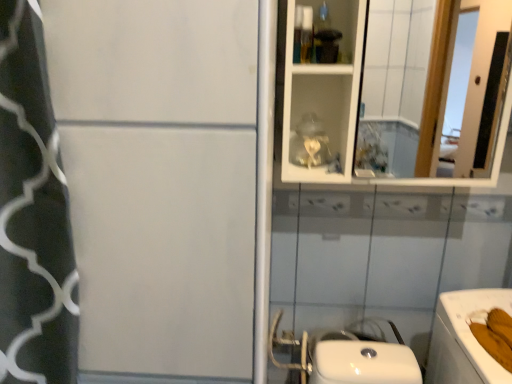
Image resolution: width=512 pixels, height=384 pixels. What do you see at coordinates (430, 87) in the screenshot? I see `white glossy mirror at upper right` at bounding box center [430, 87].

Where is `white glossy mirror at upper right`? white glossy mirror at upper right is located at coordinates (430, 87).

The height and width of the screenshot is (384, 512). In order to click on white glossy bath at lower right in this screenshot , I will do `click(465, 338)`.

This screenshot has width=512, height=384. Describe the element at coordinates (465, 338) in the screenshot. I see `white glossy bath at lower right` at that location.

Locate an element on the screen. This screenshot has height=384, width=512. white glossy mirror at upper right is located at coordinates (430, 87).

Considering the positions of objects white glossy bath at lower right and white glossy mirror at upper right in the image provided, who is more to the left, white glossy bath at lower right or white glossy mirror at upper right?

Positioned to the left is white glossy mirror at upper right.

Which object is further away from the camera taking this photo, white glossy bath at lower right or white glossy mirror at upper right?

Positioned behind is white glossy mirror at upper right.

Is point (445, 301) less distant than point (418, 119)?

Yes, point (445, 301) is in front of point (418, 119).

From the image's perspective, between white glossy bath at lower right and white glossy mirror at upper right, who is located below?

white glossy bath at lower right is shown below in the image.

Looking at this image, from a real-world perspective, does white glossy bath at lower right sit lower than white glossy mirror at upper right?

Yes, from a real-world perspective, white glossy bath at lower right is below white glossy mirror at upper right.

Which object is thinner, white glossy bath at lower right or white glossy mirror at upper right?

Thinner between the two is white glossy mirror at upper right.

Is white glossy bath at lower right taller or shorter than white glossy mirror at upper right?

Clearly, white glossy bath at lower right is shorter compared to white glossy mirror at upper right.

Which of these two, white glossy bath at lower right or white glossy mirror at upper right, is smaller?

Smaller between the two is white glossy mirror at upper right.

Choose the correct answer: Is white glossy bath at lower right inside white glossy mirror at upper right or outside it?

white glossy bath at lower right is not inside white glossy mirror at upper right, it's outside.

Is white glossy bath at lower right beside white glossy mirror at upper right?

They are not placed beside each other.

Is white glossy bath at lower right facing away from white glossy mirror at upper right?

No, white glossy bath at lower right is not facing the opposite direction of white glossy mirror at upper right.

How much distance is there between white glossy bath at lower right and white glossy mirror at upper right?

white glossy bath at lower right and white glossy mirror at upper right are 1.63 meters apart.

Locate an element on the screen. Image resolution: width=512 pixels, height=384 pixels. mirror that appears behind the white glossy bath at lower right is located at coordinates (430, 87).

Between white glossy mirror at upper right and white glossy bath at lower right, which one appears on the left side from the viewer's perspective?

Positioned to the left is white glossy mirror at upper right.

Considering the relative positions of white glossy mirror at upper right and white glossy bath at lower right in the image provided, is white glossy mirror at upper right in front of white glossy bath at lower right?

No, the depth of white glossy mirror at upper right is greater than that of white glossy bath at lower right.

Considering the points (376, 131) and (449, 380), which point is in front, point (376, 131) or point (449, 380)?

The point (449, 380) is closer to the camera.

From the image's perspective, is white glossy mirror at upper right on white glossy bath at lower right?

Yes, from the image's perspective, white glossy mirror at upper right is over white glossy bath at lower right.

From a real-world perspective, is white glossy mirror at upper right on top of white glossy bath at lower right?

Yes, from a real-world perspective, white glossy mirror at upper right is above white glossy bath at lower right.

Can you confirm if white glossy mirror at upper right is wider than white glossy bath at lower right?

No.

Can you confirm if white glossy mirror at upper right is shorter than white glossy bath at lower right?

In fact, white glossy mirror at upper right may be taller than white glossy bath at lower right.

Is white glossy mirror at upper right smaller than white glossy bath at lower right?

Indeed, white glossy mirror at upper right has a smaller size compared to white glossy bath at lower right.

Does white glossy mirror at upper right contain white glossy bath at lower right?

No, white glossy bath at lower right is not inside white glossy mirror at upper right.

Is white glossy mirror at upper right far from white glossy bath at lower right?

Yes, white glossy mirror at upper right is far from white glossy bath at lower right.

Is white glossy mirror at upper right aimed at white glossy bath at lower right?

No, white glossy mirror at upper right is not facing towards white glossy bath at lower right.

How many degrees apart are the facing directions of white glossy mirror at upper right and white glossy bath at lower right?

0.475 degrees.

Locate an element on the screen. The image size is (512, 384). mirror lying behind the white glossy bath at lower right is located at coordinates (430, 87).

Find the location of a particular element. The height and width of the screenshot is (384, 512). bath that is below the white glossy mirror at upper right (from the image's perspective) is located at coordinates click(x=465, y=338).

Find the location of a particular element. The image size is (512, 384). bath below the white glossy mirror at upper right (from a real-world perspective) is located at coordinates (465, 338).